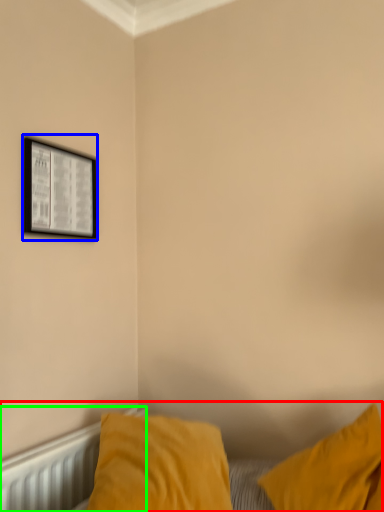
Question: Which object is the farthest from bed (highlighted by a red box)? Choose among these: picture frame (highlighted by a blue box) or radiator (highlighted by a green box).

Choices:
 (A) picture frame
 (B) radiator

Answer: (A)